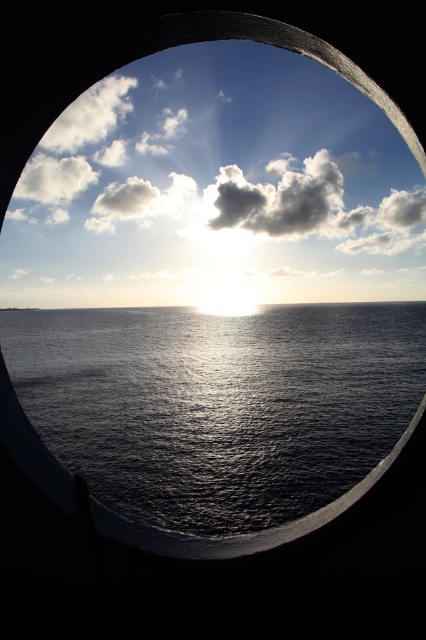
Question: Does glistening dark water at center appear under white fluffy cloud at upper center?

Choices:
 (A) no
 (B) yes

Answer: (B)

Question: Which object is the closest to the white fluffy cloud at upper center?

Choices:
 (A) glistening dark water at center
 (B) cloudy sky at upper center

Answer: (B)

Question: Observing the image, what is the correct spatial positioning of cloudy sky at upper center in reference to glistening dark water at center?

Choices:
 (A) above
 (B) below

Answer: (A)

Question: Which object is positioned closest to the white fluffy cloud at upper center?

Choices:
 (A) cloudy sky at upper center
 (B) glistening dark water at center

Answer: (A)

Question: Is cloudy sky at upper center to the left of white fluffy cloud at upper center from the viewer's perspective?

Choices:
 (A) no
 (B) yes

Answer: (B)

Question: Which object is the farthest from the glistening dark water at center?

Choices:
 (A) white fluffy cloud at upper center
 (B) cloudy sky at upper center

Answer: (A)